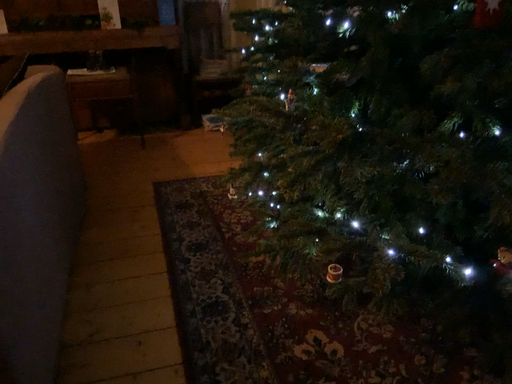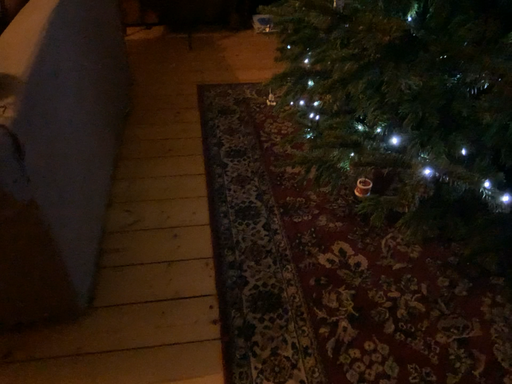
Question: How did the camera likely rotate when shooting the video?

Choices:
 (A) rotated upward
 (B) rotated downward

Answer: (B)